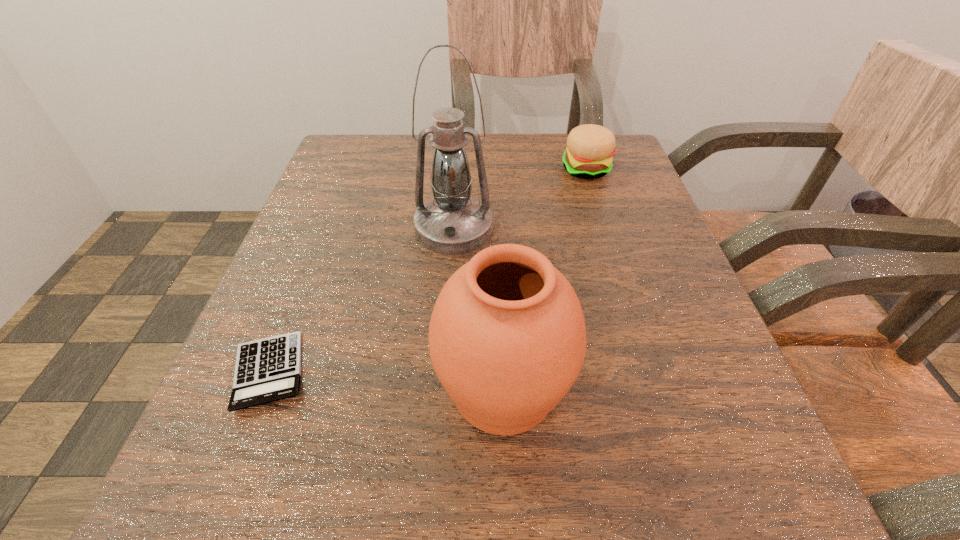
Locate an element on the screen. The height and width of the screenshot is (540, 960). the third nearest object is located at coordinates (452, 223).

In order to click on oil lamp in this screenshot , I will do `click(452, 223)`.

Where is `the second tallest object`? The width and height of the screenshot is (960, 540). the second tallest object is located at coordinates (507, 338).

The width and height of the screenshot is (960, 540). I want to click on hamburger, so click(590, 147).

Locate an element on the screen. the rightmost object is located at coordinates (590, 147).

Image resolution: width=960 pixels, height=540 pixels. What are the coordinates of `the shortest object` in the screenshot? It's located at (269, 369).

The height and width of the screenshot is (540, 960). Find the location of `the leftmost object`. the leftmost object is located at coordinates (269, 369).

Identify the location of vacant area situated 0.080m on the right of the tallest object. The image size is (960, 540). (538, 229).

You are a GUI agent. You are given a task and a screenshot of the screen. Output one action in this format:
    pyautogui.click(x=<x>, y=<y>)
    Task: Click on the free space located 0.220m on the back of the third shortest object
    The height and width of the screenshot is (540, 960).
    Given the screenshot: What is the action you would take?
    pyautogui.click(x=496, y=237)

You are a GUI agent. You are given a task and a screenshot of the screen. Output one action in this format:
    pyautogui.click(x=<x>, y=<y>)
    Task: Click on the vacant space located on the front of the hamburger
    
    Given the screenshot: What is the action you would take?
    pyautogui.click(x=605, y=229)